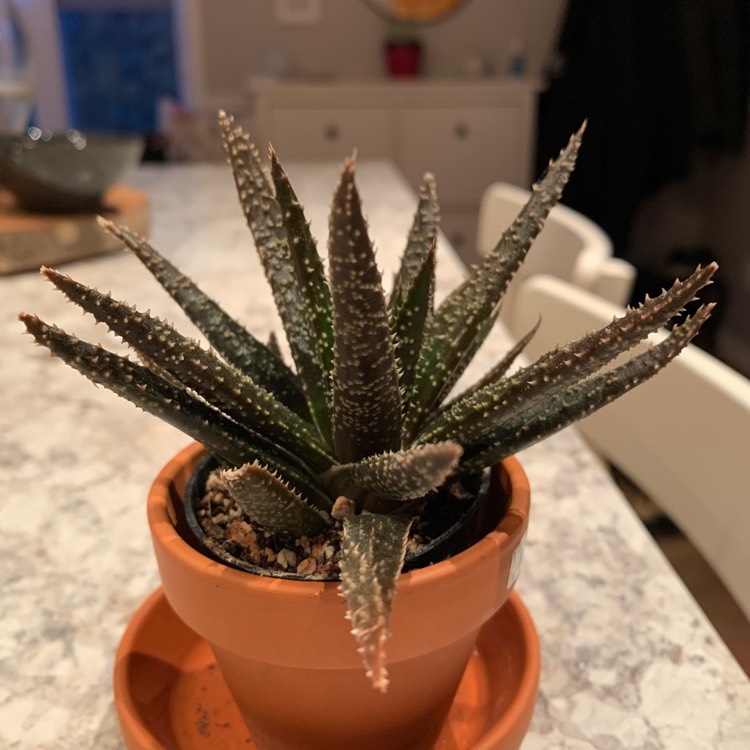
Where is `dresser`? dresser is located at coordinates (411, 118).